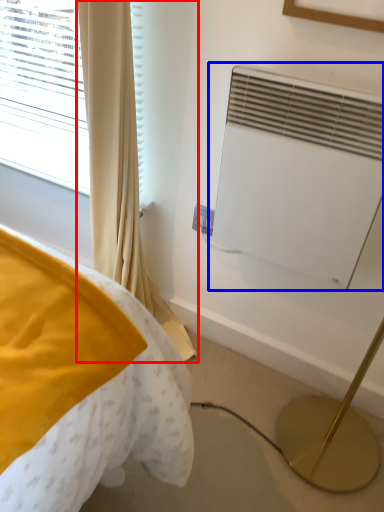
Question: Which object appears farthest to the camera in this image, curtain (highlighted by a red box) or air conditioning (highlighted by a blue box)?

Choices:
 (A) curtain
 (B) air conditioning

Answer: (B)